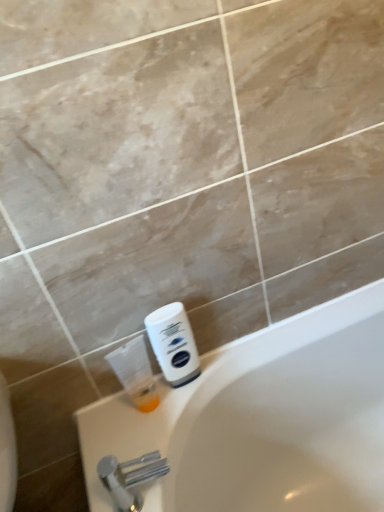
The width and height of the screenshot is (384, 512). I want to click on translucent plastic bottle at lower left, so click(x=135, y=373).

Which of these two, silver metallic faucet at lower left or white matte shaving cream at lower right, stands shorter?

silver metallic faucet at lower left.

Are silver metallic faucet at lower left and white matte shaving cream at lower right located far from each other?

No.

From a real-world perspective, does silver metallic faucet at lower left sit lower than white matte shaving cream at lower right?

Indeed, from a real-world perspective, silver metallic faucet at lower left is positioned beneath white matte shaving cream at lower right.

How different are the orientations of silver metallic faucet at lower left and white matte shaving cream at lower right in degrees?

90 degrees separate the facing orientations of silver metallic faucet at lower left and white matte shaving cream at lower right.

From a real-world perspective, which is physically below, translucent plastic bottle at lower left or white matte shaving cream at lower right?

translucent plastic bottle at lower left, from a real-world perspective.

Considering the sizes of objects translucent plastic bottle at lower left and white matte shaving cream at lower right in the image provided, who is smaller, translucent plastic bottle at lower left or white matte shaving cream at lower right?

white matte shaving cream at lower right.

From the image's perspective, which object appears higher, translucent plastic bottle at lower left or white matte shaving cream at lower right?

white matte shaving cream at lower right.

From the picture: From the image's perspective, relative to silver metallic faucet at lower left, is translucent plastic bottle at lower left above or below?

translucent plastic bottle at lower left is situated higher than silver metallic faucet at lower left in the image.

How different are the orientations of translucent plastic bottle at lower left and silver metallic faucet at lower left in degrees?

They differ by 90 degrees in their facing directions.

Based on their positions, is translucent plastic bottle at lower left located to the left or right of silver metallic faucet at lower left?

Based on their positions, translucent plastic bottle at lower left is located to the left of silver metallic faucet at lower left.

Who is bigger, translucent plastic bottle at lower left or silver metallic faucet at lower left?

translucent plastic bottle at lower left.

Between silver metallic faucet at lower left and translucent plastic bottle at lower left, which one has smaller size?

With smaller size is silver metallic faucet at lower left.

Is translucent plastic bottle at lower left at the back of silver metallic faucet at lower left?

No, silver metallic faucet at lower left's orientation is not away from translucent plastic bottle at lower left.

Is silver metallic faucet at lower left surrounding translucent plastic bottle at lower left?

No, translucent plastic bottle at lower left is not surrounded by silver metallic faucet at lower left.

In terms of height, does silver metallic faucet at lower left look taller or shorter compared to translucent plastic bottle at lower left?

Clearly, silver metallic faucet at lower left is shorter compared to translucent plastic bottle at lower left.

From the image's perspective, is white matte shaving cream at lower right above silver metallic faucet at lower left?

Correct, white matte shaving cream at lower right appears higher than silver metallic faucet at lower left in the image.

Which is in front, white matte shaving cream at lower right or silver metallic faucet at lower left?

silver metallic faucet at lower left.

From a real-world perspective, who is located lower, white matte shaving cream at lower right or silver metallic faucet at lower left?

In real-world perspective, silver metallic faucet at lower left is lower.

In the scene shown: Is white matte shaving cream at lower right further to camera compared to translucent plastic bottle at lower left?

Yes, white matte shaving cream at lower right is behind translucent plastic bottle at lower left.

Is white matte shaving cream at lower right located outside translucent plastic bottle at lower left?

Absolutely, white matte shaving cream at lower right is external to translucent plastic bottle at lower left.

Find the location of a particular element. The image size is (384, 512). tap that is below the white matte shaving cream at lower right (from the image's perspective) is located at coordinates [x=130, y=477].

Locate an element on the screen. The height and width of the screenshot is (512, 384). shaving cream above the translucent plastic bottle at lower left (from a real-world perspective) is located at coordinates (173, 343).

From the picture: Which object lies nearer to the anchor point translucent plastic bottle at lower left, silver metallic faucet at lower left or white matte shaving cream at lower right?

white matte shaving cream at lower right.

Considering their positions, is white matte shaving cream at lower right positioned closer to translucent plastic bottle at lower left than silver metallic faucet at lower left?

white matte shaving cream at lower right.

Based on their spatial positions, is white matte shaving cream at lower right or translucent plastic bottle at lower left closer to silver metallic faucet at lower left?

The object closer to silver metallic faucet at lower left is translucent plastic bottle at lower left.

When comparing their distances from white matte shaving cream at lower right, does silver metallic faucet at lower left or translucent plastic bottle at lower left seem closer?

The object closer to white matte shaving cream at lower right is translucent plastic bottle at lower left.

From the image, which object appears to be nearer to white matte shaving cream at lower right, translucent plastic bottle at lower left or silver metallic faucet at lower left?

translucent plastic bottle at lower left is closer to white matte shaving cream at lower right.

From the image, which object appears to be farther from silver metallic faucet at lower left, translucent plastic bottle at lower left or white matte shaving cream at lower right?

The object further to silver metallic faucet at lower left is white matte shaving cream at lower right.

This screenshot has width=384, height=512. I want to click on cleaning product between white matte shaving cream at lower right and silver metallic faucet at lower left in the vertical direction, so click(x=135, y=373).